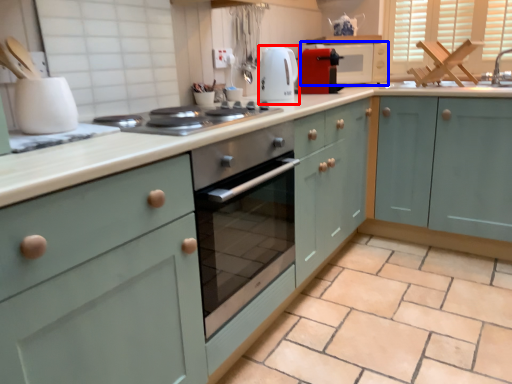
Question: Which of the following is the farthest to the observer, kitchen appliance (highlighted by a red box) or microwave (highlighted by a blue box)?

Choices:
 (A) kitchen appliance
 (B) microwave

Answer: (B)